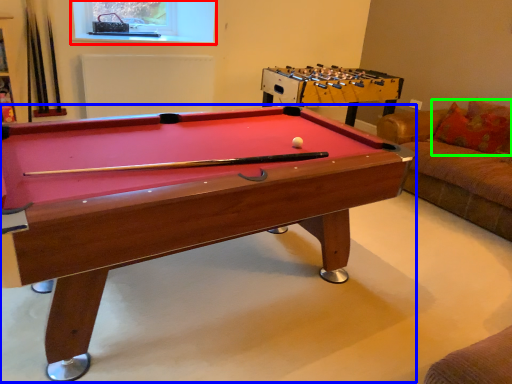
Question: Which object is positioned closest to window screen (highlighted by a red box)? Select from billiard table (highlighted by a blue box) and pillow (highlighted by a green box).

Choices:
 (A) billiard table
 (B) pillow

Answer: (A)